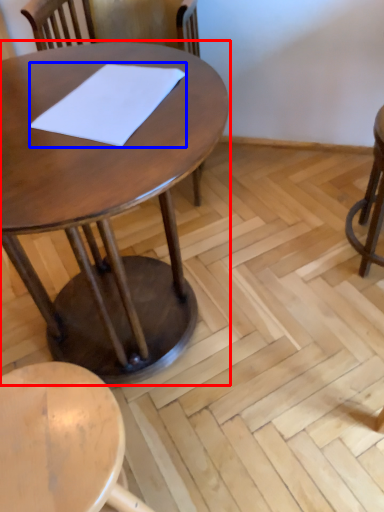
Question: Which point is closer to the camera, table (highlighted by a red box) or notepad (highlighted by a blue box)?

Choices:
 (A) table
 (B) notepad

Answer: (A)